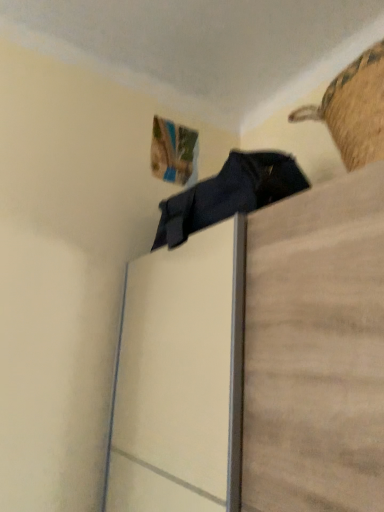
Question: Is matte black clothing at upper center taller or shorter than woven straw basket at upper right?

Choices:
 (A) short
 (B) tall

Answer: (B)

Question: Is matte black clothing at upper center bigger or smaller than woven straw basket at upper right?

Choices:
 (A) small
 (B) big

Answer: (B)

Question: Is point (329, 489) positioned closer to the camera than point (377, 155)?

Choices:
 (A) closer
 (B) farther

Answer: (A)

Question: Relative to matte black clothing at upper center, is woven straw basket at upper right in front or behind?

Choices:
 (A) behind
 (B) front

Answer: (A)

Question: Is woven straw basket at upper right inside the boundaries of matte black clothing at upper center, or outside?

Choices:
 (A) inside
 (B) outside

Answer: (B)

Question: From the image's perspective, is woven straw basket at upper right positioned above or below matte black clothing at upper center?

Choices:
 (A) above
 (B) below

Answer: (A)

Question: Considering the positions of woven straw basket at upper right and matte black clothing at upper center in the image, is woven straw basket at upper right bigger or smaller than matte black clothing at upper center?

Choices:
 (A) small
 (B) big

Answer: (A)